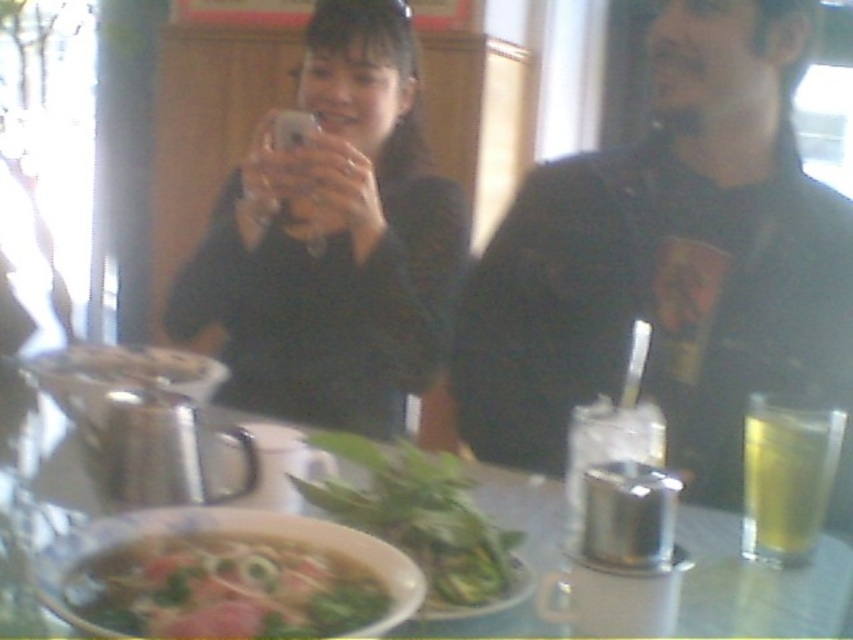
Question: Does metallic bowl at center have a larger size compared to green leafy vegetable at center?

Choices:
 (A) no
 (B) yes

Answer: (B)

Question: Can you confirm if metallic bowl at center is bigger than yellow translucent glass at right?

Choices:
 (A) yes
 (B) no

Answer: (A)

Question: Observing the image, what is the correct spatial positioning of metallic silver cup at right in reference to yellow translucent glass at right?

Choices:
 (A) below
 (B) above

Answer: (B)

Question: Which object is closer to the camera taking this photo?

Choices:
 (A) metallic silver cup at right
 (B) green leafy vegetable soup at center

Answer: (B)

Question: Which object is closer to the camera taking this photo?

Choices:
 (A) black matte phone at center
 (B) green leafy vegetable at center

Answer: (B)

Question: Which point is farther to the camera?

Choices:
 (A) pyautogui.click(x=798, y=241)
 (B) pyautogui.click(x=183, y=627)
 (C) pyautogui.click(x=796, y=576)
 (D) pyautogui.click(x=421, y=564)

Answer: (A)